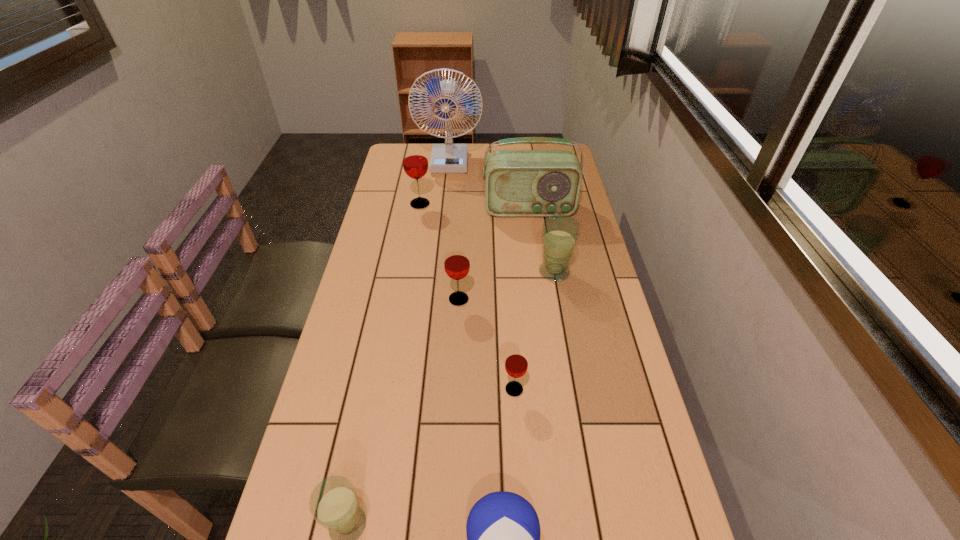
This screenshot has width=960, height=540. Find the location of `the farthest object`. the farthest object is located at coordinates (449, 158).

Locate an element on the screen. This screenshot has height=540, width=960. fan is located at coordinates (449, 158).

Find the location of a particular element. The image size is (960, 540). radio receiver is located at coordinates (518, 183).

Find the location of a particular element. The height and width of the screenshot is (540, 960). the farthest red glass is located at coordinates (415, 163).

Where is `the farthest glass`? The image size is (960, 540). the farthest glass is located at coordinates (415, 163).

I want to click on the third glass from left to right, so 456,261.

The height and width of the screenshot is (540, 960). I want to click on the third nearest glass, so click(x=456, y=261).

Find the location of a particular element. Image resolution: width=960 pixels, height=540 pixels. the bigger blue glass is located at coordinates (560, 233).

The width and height of the screenshot is (960, 540). Identify the location of the farther blue glass. (560, 233).

Where is `the smallest red glass`? The width and height of the screenshot is (960, 540). the smallest red glass is located at coordinates (516, 363).